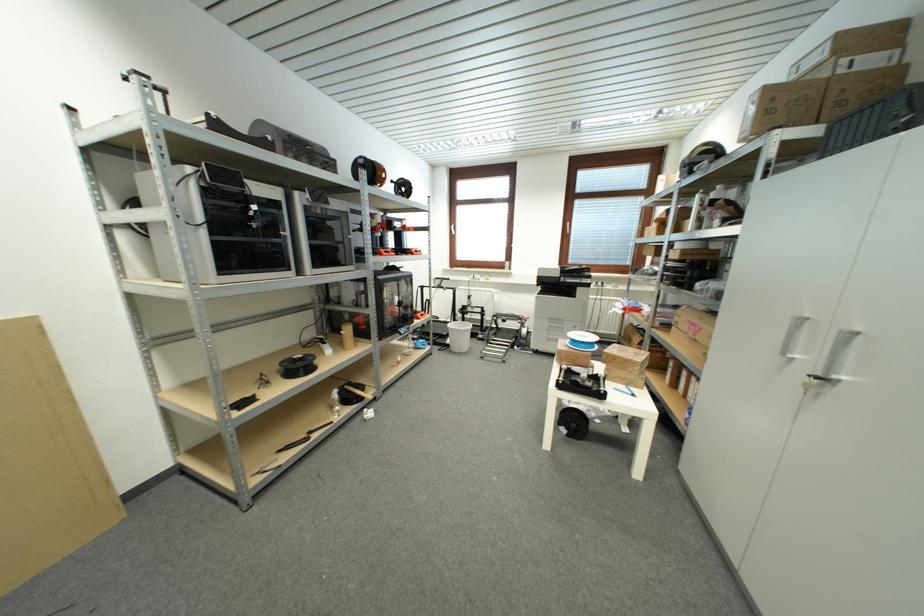
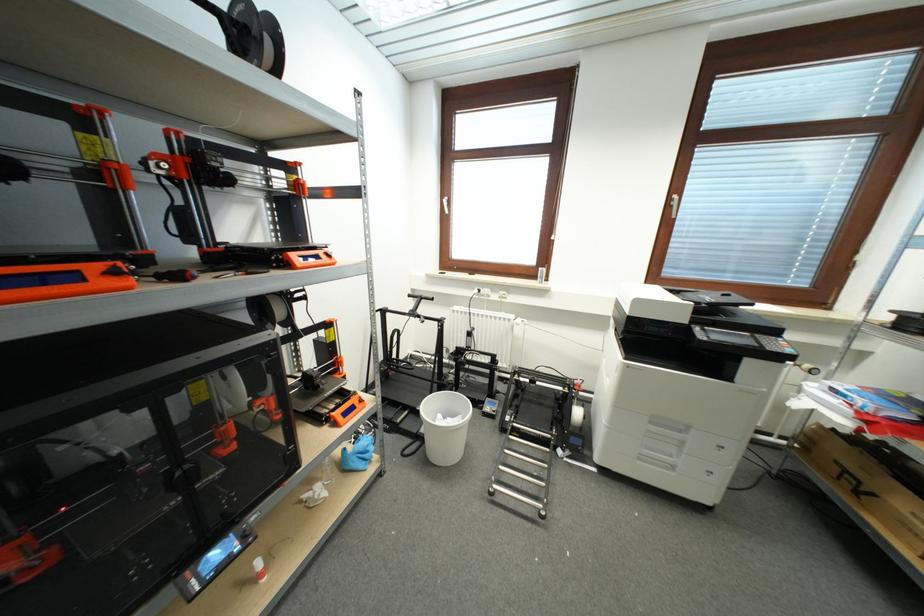
The point at (453, 344) is marked in the first image. Where is the corresponding point in the second image?

(427, 434)